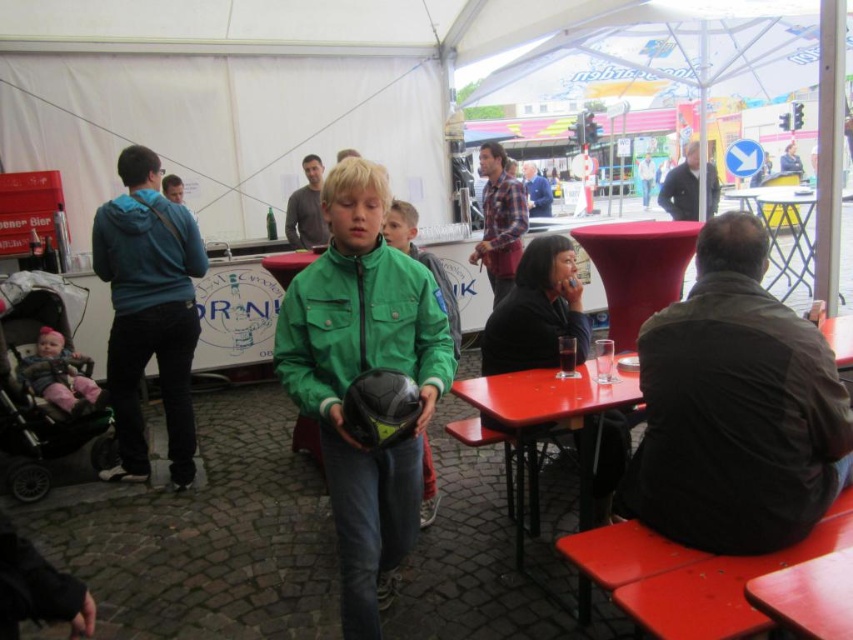
Who is higher up, green fabric jacket at center or pink fabric baby carriage at lower left?

green fabric jacket at center is higher up.

Does point (323, 372) lie behind point (74, 385)?

No, it is not.

You are a GUI agent. You are given a task and a screenshot of the screen. Output one action in this format:
    pyautogui.click(x=<x>, y=<y>)
    Task: Click on the green fabric jacket at center
    
    Given the screenshot: What is the action you would take?
    pyautogui.click(x=360, y=326)

Does green matte jacket at center have a lesser height compared to blue fleece jacket at left?

Correct, green matte jacket at center is not as tall as blue fleece jacket at left.

Which is below, green matte jacket at center or blue fleece jacket at left?

green matte jacket at center

Measure the distance between point (407, 352) and camera.

They are 7.13 feet apart.

The width and height of the screenshot is (853, 640). What are the coordinates of `green matte jacket at center` in the screenshot? It's located at (358, 372).

Does point (665, 337) lie in front of point (289, 204)?

Yes, it is.

Who is positioned more to the left, dark brown leather jacket at right or matte gray shirt at center?

matte gray shirt at center is more to the left.

Does point (669, 353) come behind point (291, 225)?

No, it is not.

At what (x,y) coordinates should I click in order to perform the action: click on dark brown leather jacket at right. Please return your answer as a coordinate pair (x, y). This screenshot has width=853, height=640. Looking at the image, I should click on (735, 408).